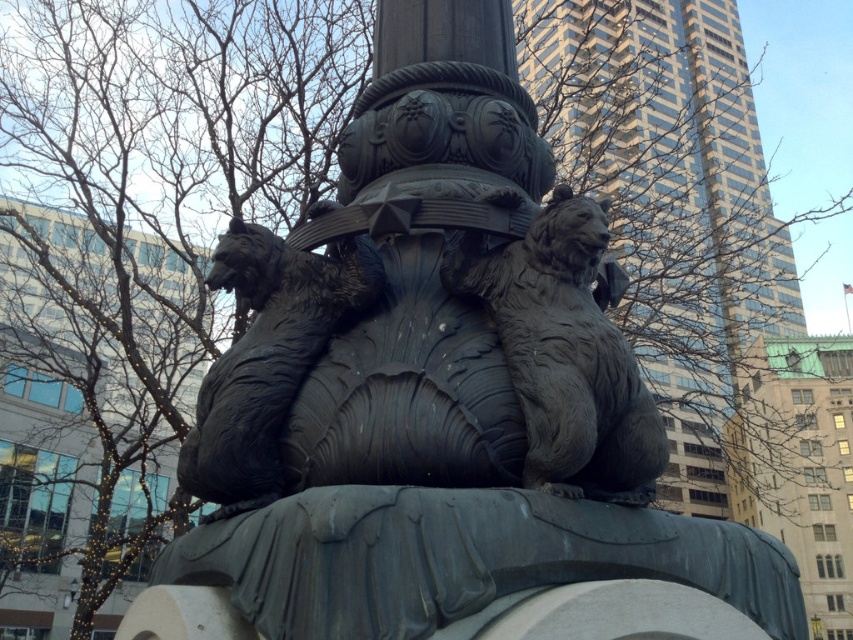
Question: Which point is farther to the camera?

Choices:
 (A) (265, 284)
 (B) (630, 419)

Answer: (A)

Question: Among these points, which one is nearest to the camera?

Choices:
 (A) (216, 384)
 (B) (596, 349)

Answer: (B)

Question: Can you confirm if matte gray lion at center is thinner than matte bronze lion at center?

Choices:
 (A) no
 (B) yes

Answer: (A)

Question: Observing the image, what is the correct spatial positioning of matte gray lion at center in reference to matte bronze lion at center?

Choices:
 (A) left
 (B) right

Answer: (B)

Question: Considering the relative positions of matte gray lion at center and matte bronze lion at center in the image provided, where is matte gray lion at center located with respect to matte bronze lion at center?

Choices:
 (A) above
 (B) below

Answer: (A)